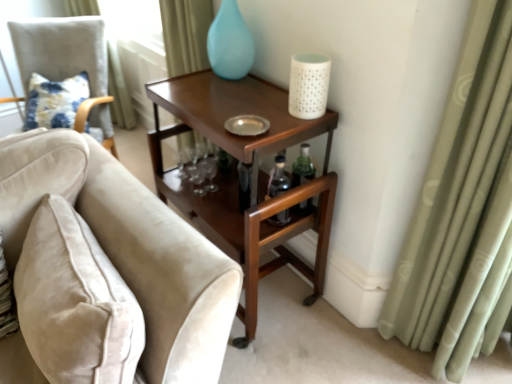
The width and height of the screenshot is (512, 384). Identify the location of free space above mahogany wood side table at upper right (from a real-world perspective). (223, 103).